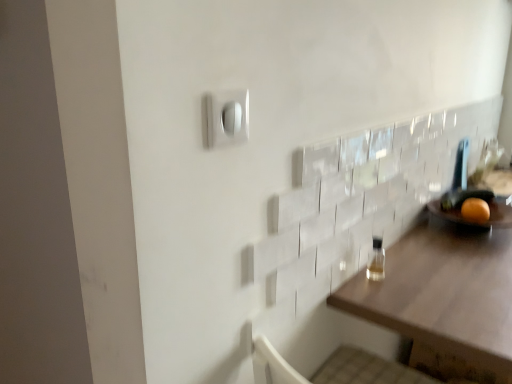
Question: From the image's perspective, would you say brown wooden table at right is positioned over clear glass bottle at right?

Choices:
 (A) yes
 (B) no

Answer: (B)

Question: Is brown wooden table at right positioned before clear glass bottle at right?

Choices:
 (A) yes
 (B) no

Answer: (A)

Question: From a real-world perspective, is brown wooden table at right below clear glass bottle at right?

Choices:
 (A) yes
 (B) no

Answer: (A)

Question: Is clear glass bottle at right at the back of brown wooden table at right?

Choices:
 (A) no
 (B) yes

Answer: (A)

Question: Is brown wooden table at right further to camera compared to clear glass bottle at right?

Choices:
 (A) no
 (B) yes

Answer: (A)

Question: In the image, is clear glass bottle at right positioned in front of or behind brown wooden table at right?

Choices:
 (A) behind
 (B) front

Answer: (A)

Question: From a real-world perspective, relative to brown wooden table at right, is clear glass bottle at right vertically above or below?

Choices:
 (A) below
 (B) above

Answer: (B)

Question: Does point (375, 271) appear closer or farther from the camera than point (373, 309)?

Choices:
 (A) closer
 (B) farther

Answer: (B)

Question: In terms of height, does clear glass bottle at right look taller or shorter compared to brown wooden table at right?

Choices:
 (A) tall
 (B) short

Answer: (B)

Question: In terms of width, does clear glass bottle at right look wider or thinner when compared to orange matte at right?

Choices:
 (A) wide
 (B) thin

Answer: (B)

Question: Relative to orange matte at right, is clear glass bottle at right in front or behind?

Choices:
 (A) front
 (B) behind

Answer: (A)

Question: In terms of size, does clear glass bottle at right appear bigger or smaller than orange matte at right?

Choices:
 (A) big
 (B) small

Answer: (B)

Question: Considering the relative positions of clear glass bottle at right and orange matte at right in the image provided, is clear glass bottle at right to the left or to the right of orange matte at right?

Choices:
 (A) left
 (B) right

Answer: (A)

Question: Is orange matte at right situated inside brown wooden table at right or outside?

Choices:
 (A) outside
 (B) inside

Answer: (A)

Question: Relative to brown wooden table at right, is orange matte at right in front or behind?

Choices:
 (A) behind
 (B) front

Answer: (A)